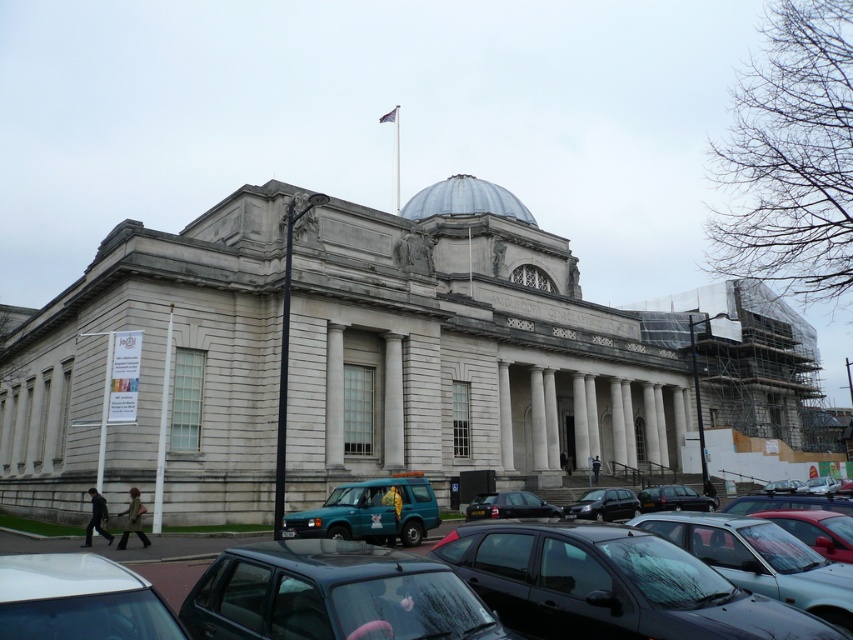
Does point (532, 632) come behind point (657, 490)?

No, it is in front of (657, 490).

Between point (514, 584) and point (660, 492), which one is positioned in front?

Point (514, 584) is more forward.

Image resolution: width=853 pixels, height=640 pixels. Find the location of `metallic gray cars at lower center`. metallic gray cars at lower center is located at coordinates (613, 586).

Is shiny red car at lower right to the right of metallic blue van at center from the viewer's perspective?

In fact, shiny red car at lower right is to the left of metallic blue van at center.

Is point (820, 531) in front of point (802, 484)?

That is True.

I want to click on shiny red car at lower right, so click(816, 529).

Locate an element on the screen. shiny red car at lower right is located at coordinates (816, 529).

Between point (210, 593) and point (821, 486), which one is positioned in front?

Positioned in front is point (210, 593).

Measure the distance from metallic gray cars at lower center to metallic blue van at lower right.

metallic gray cars at lower center and metallic blue van at lower right are 173.36 feet apart.

Which is behind, point (547, 586) or point (817, 484)?

Point (817, 484)

I want to click on metallic gray cars at lower center, so click(613, 586).